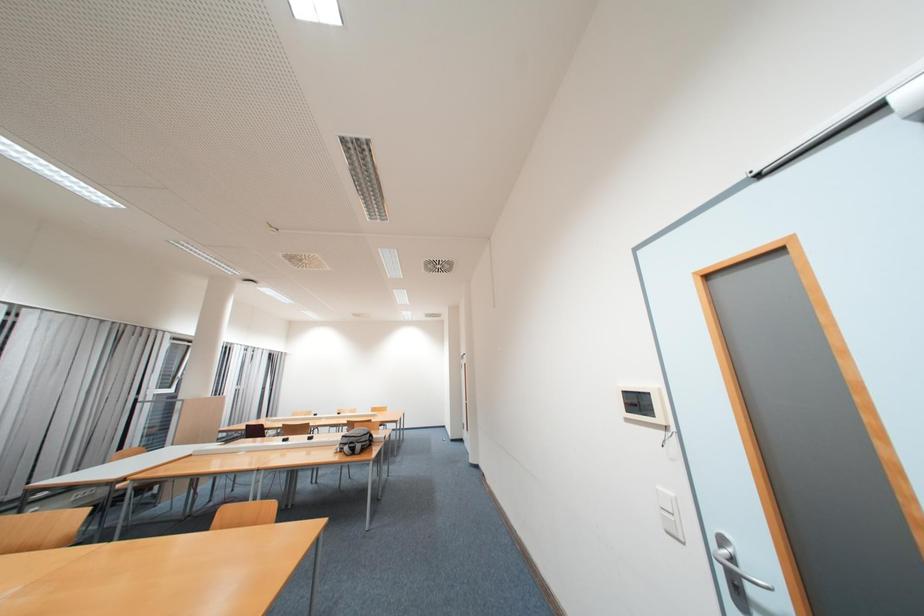
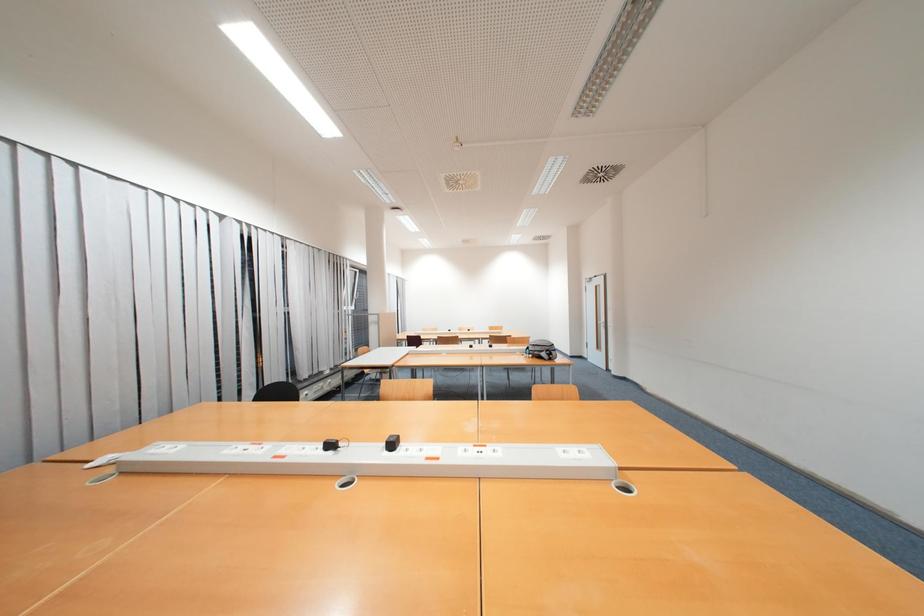
Question: The images are taken continuously from a first-person perspective. In which direction are you moving?

Choices:
 (A) Left
 (B) Right
 (C) Forward
 (D) Backward

Answer: (A)